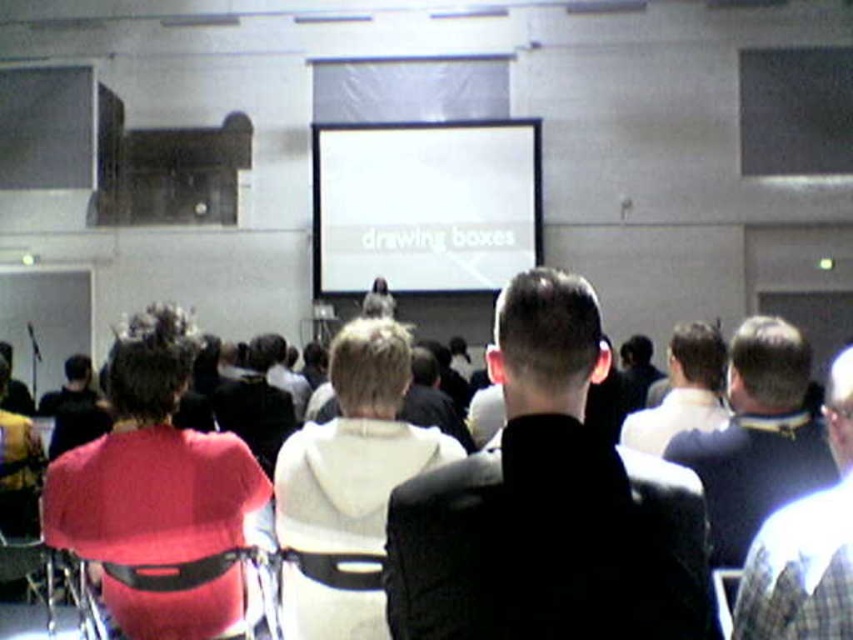
You are an attendee at the front row of the conference room. You want to see the presentation clearly. Is the white hoodie at center blocking your view of the white matte projection screen at center?

The white hoodie at center is behind the white matte projection screen at center, so it is not blocking your view of the screen.

Consider the image. You are sitting in the conference room and want to borrow a jacket from either the white fleece jacket at center or the dark brown leather jacket at center. If you need to reach one that is closer to you, which one should you choose?

Both the white fleece jacket at center and the dark brown leather jacket at center are at the same distance from you since they are both at center, so you can choose either one.

You are a photographer who needs to take a photo of the white fleece jacket at center without getting too close to it. The camera you are using has a maximum focus range of 5 feet. Can you take the photo from your current position?

The white fleece jacket at center and camera are 5.75 feet apart from each other. Since the maximum focus range is 5 feet, the camera cannot focus on the white fleece jacket at center from the current position.